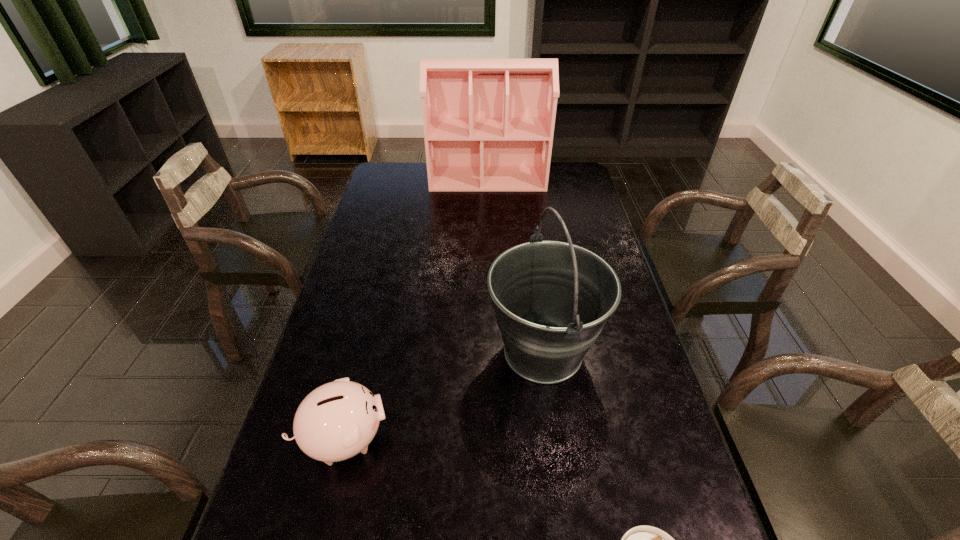
Find the location of `free space at the right edge of the desktop`. free space at the right edge of the desktop is located at coordinates [x=562, y=231].

This screenshot has height=540, width=960. Identify the location of vacant point at the far left corner. (406, 187).

Identify the location of vacant area at the far right corner of the desktop. (563, 189).

The height and width of the screenshot is (540, 960). In order to click on empty space between the farthest object and the piggy bank in this screenshot , I will do pos(416,309).

Locate an element on the screen. The width and height of the screenshot is (960, 540). vacant space that is in between the piggy bank and the bucket is located at coordinates (444, 395).

At what (x,y) coordinates should I click in order to perform the action: click on object that is the closest to the piggy bank. Please return your answer as a coordinate pair (x, y). The height and width of the screenshot is (540, 960). Looking at the image, I should click on (552, 299).

Find the location of a particular element. Image resolution: width=960 pixels, height=540 pixels. the third closest object to the farthest object is located at coordinates (643, 539).

Locate an element on the screen. vacant point that satisfies the following two spatial constraints: 1. on the back side of the bucket; 2. on the right side of the piggy bank is located at coordinates (365, 352).

Identify the location of vacant space that satisfies the following two spatial constraints: 1. on the front-facing side of the bucket; 2. on the right side of the farthest object. (492, 352).